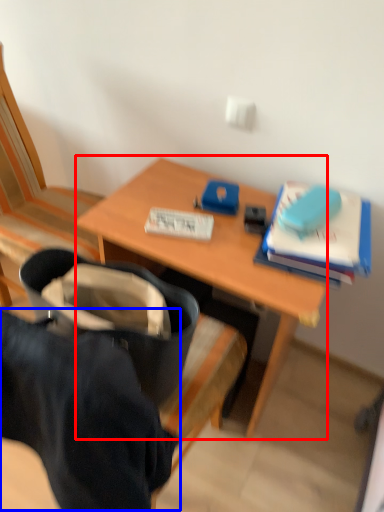
Question: Among these objects, which one is farthest to the camera, desk (highlighted by a red box) or clothing (highlighted by a blue box)?

Choices:
 (A) desk
 (B) clothing

Answer: (A)